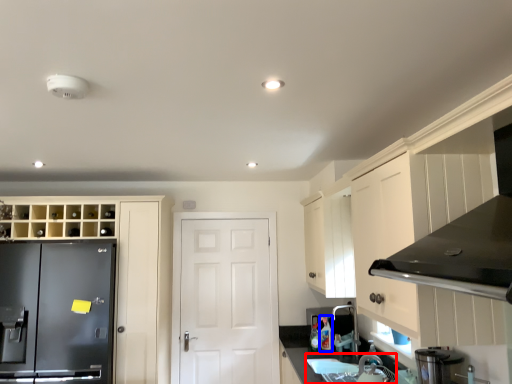
Question: Which of the following is the farthest to the observer, sink (highlighted by a red box) or bottle (highlighted by a blue box)?

Choices:
 (A) sink
 (B) bottle

Answer: (B)